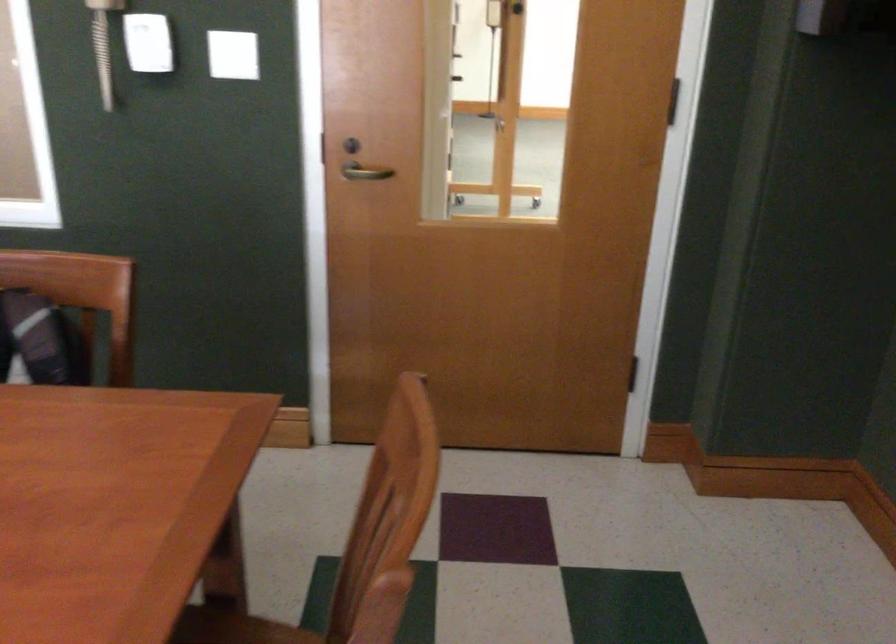
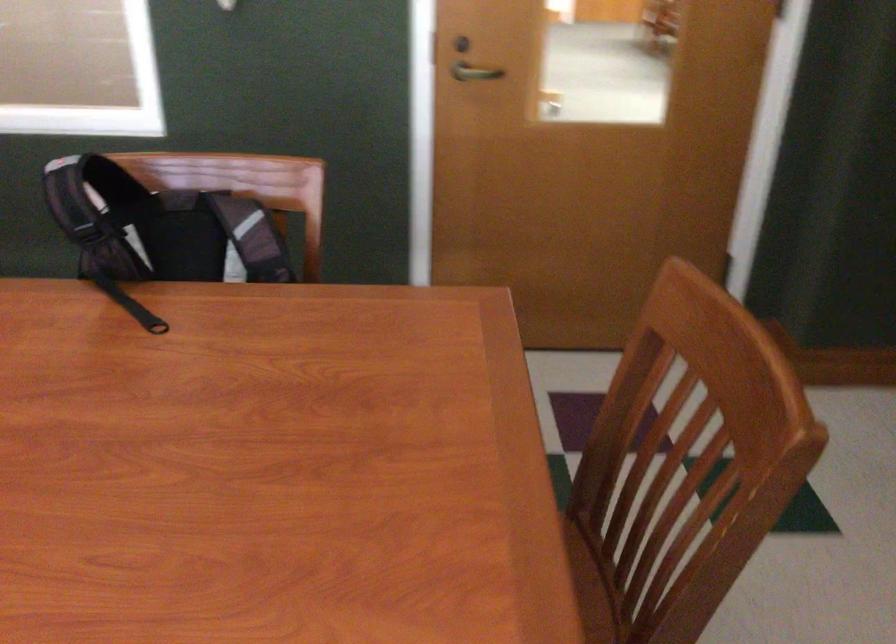
Question: Which direction would the cameraman need to move to produce the second image? Reply with the corresponding letter.

Choices:
 (A) Left
 (B) Right
 (C) Forward
 (D) Backward

Answer: (A)